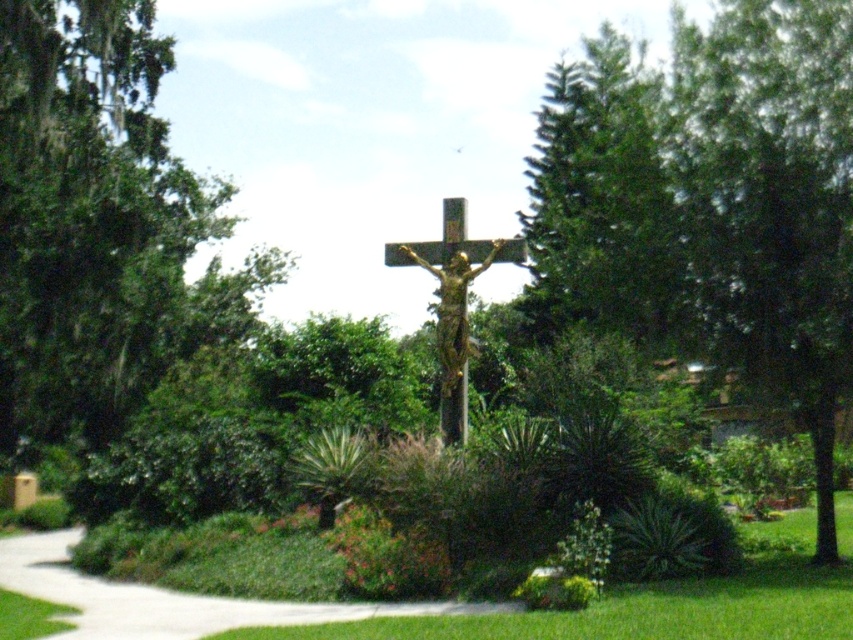
From the picture: Who is positioned more to the left, green grass at center or gold textured crucifix at center?

gold textured crucifix at center

You are a GUI agent. You are given a task and a screenshot of the screen. Output one action in this format:
    pyautogui.click(x=<x>, y=<y>)
    Task: Click on the green grass at center
    The height and width of the screenshot is (640, 853).
    Given the screenshot: What is the action you would take?
    pyautogui.click(x=660, y=602)

Who is shorter, green textured pine tree at upper right or green grass at center?

green grass at center is shorter.

Measure the distance from green textured pine tree at upper right to green grass at center.

29.07 feet

Between point (532, 172) and point (489, 621), which one is positioned in front?

Point (489, 621)

I want to click on green textured pine tree at upper right, so click(x=602, y=204).

Does green leafy tree at center appear on the right side of green textured pine tree at upper right?

Correct, you'll find green leafy tree at center to the right of green textured pine tree at upper right.

Between point (572, 92) and point (637, 108), which one is positioned behind?

Point (572, 92)

Identify the location of green leafy tree at center. This screenshot has width=853, height=640. (712, 202).